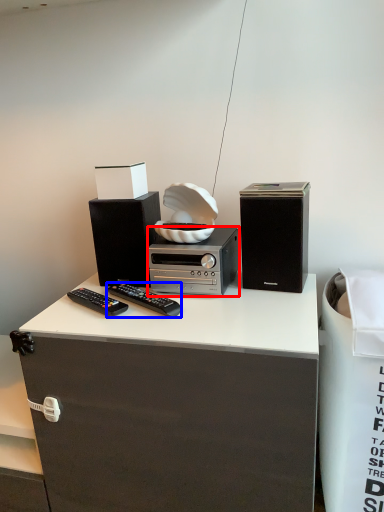
Question: Which of the following is the farthest to the observer, appliance (highlighted by a red box) or remote control (highlighted by a blue box)?

Choices:
 (A) appliance
 (B) remote control

Answer: (A)